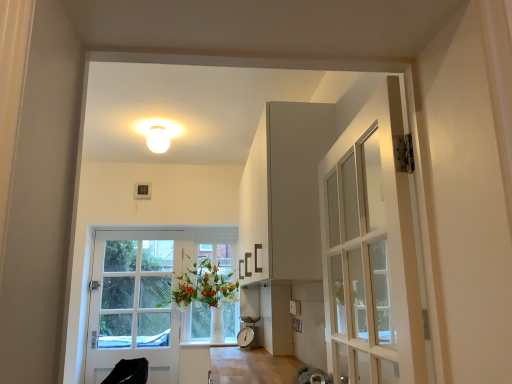
Question: Is white glossy vase at center taller than white glossy door at left?

Choices:
 (A) no
 (B) yes

Answer: (A)

Question: From the image's perspective, is white glossy vase at center beneath white glossy door at left?

Choices:
 (A) yes
 (B) no

Answer: (B)

Question: Is white glossy vase at center not close to white glossy door at left?

Choices:
 (A) no
 (B) yes

Answer: (A)

Question: Is white glossy vase at center outside of white glossy door at left?

Choices:
 (A) no
 (B) yes

Answer: (B)

Question: Is white glossy vase at center facing away from white glossy door at left?

Choices:
 (A) no
 (B) yes

Answer: (A)

Question: Considering the relative sizes of white glossy vase at center and white glossy door at left in the image provided, is white glossy vase at center bigger than white glossy door at left?

Choices:
 (A) no
 (B) yes

Answer: (B)

Question: Can you confirm if white glossy door at left is wider than white matte light fixture at upper center?

Choices:
 (A) yes
 (B) no

Answer: (B)

Question: Are white glossy door at left and white matte light fixture at upper center making contact?

Choices:
 (A) yes
 (B) no

Answer: (B)

Question: Is the position of white glossy door at left more distant than that of white matte light fixture at upper center?

Choices:
 (A) no
 (B) yes

Answer: (B)

Question: From a real-world perspective, does white glossy door at left sit lower than white matte light fixture at upper center?

Choices:
 (A) yes
 (B) no

Answer: (A)

Question: Considering the relative positions of white glossy door at left and white matte light fixture at upper center in the image provided, is white glossy door at left in front of white matte light fixture at upper center?

Choices:
 (A) no
 (B) yes

Answer: (A)

Question: Does white glossy door at left have a larger size compared to white matte light fixture at upper center?

Choices:
 (A) yes
 (B) no

Answer: (A)

Question: From a real-world perspective, is white glossy vase at center positioned under white glass vase at center based on gravity?

Choices:
 (A) yes
 (B) no

Answer: (A)